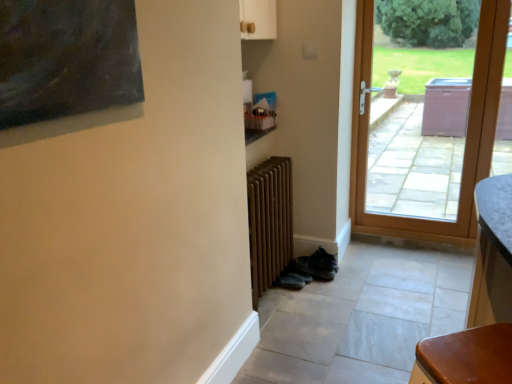
Question: From a real-world perspective, relative to brown wooden radiator at center, is brown wooden door at right vertically above or below?

Choices:
 (A) above
 (B) below

Answer: (A)

Question: Which is correct: brown wooden door at right is inside brown wooden radiator at center, or outside of it?

Choices:
 (A) inside
 (B) outside

Answer: (B)

Question: Would you say brown wooden door at right is to the left or to the right of brown wooden radiator at center in the picture?

Choices:
 (A) left
 (B) right

Answer: (B)

Question: From a real-world perspective, is brown wooden radiator at center positioned above or below brown wooden door at right?

Choices:
 (A) below
 (B) above

Answer: (A)

Question: Does point (267, 251) appear closer or farther from the camera than point (358, 231)?

Choices:
 (A) farther
 (B) closer

Answer: (B)

Question: Looking at the image, does brown wooden radiator at center seem bigger or smaller compared to brown wooden door at right?

Choices:
 (A) small
 (B) big

Answer: (A)

Question: Is brown wooden radiator at center wider or thinner than brown wooden door at right?

Choices:
 (A) wide
 (B) thin

Answer: (A)